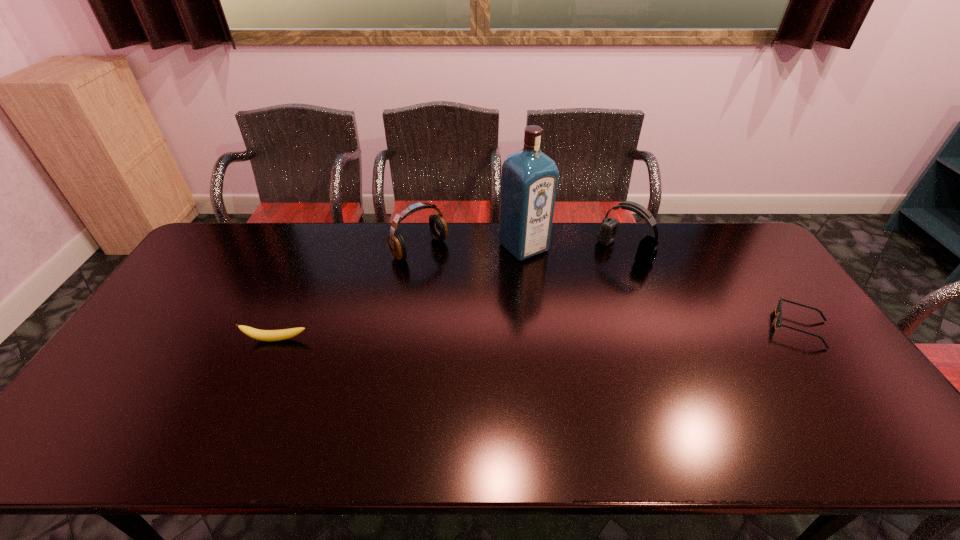
Image resolution: width=960 pixels, height=540 pixels. I want to click on free point between the rightmost object and the right headset, so click(x=712, y=289).

The height and width of the screenshot is (540, 960). Identify the location of free spot between the shortest object and the right headset. (712, 289).

Locate an element on the screen. free space that is in between the banana and the fourth object from right to left is located at coordinates (348, 294).

Image resolution: width=960 pixels, height=540 pixels. Identify the location of free space between the leftmost object and the rightmost object. (538, 333).

Image resolution: width=960 pixels, height=540 pixels. I want to click on free space between the second object from right to left and the banana, so click(x=450, y=295).

Locate an element on the screen. Image resolution: width=960 pixels, height=540 pixels. vacant area that lies between the fourth tallest object and the left headset is located at coordinates (348, 294).

This screenshot has height=540, width=960. What are the coordinates of `free space between the tallest object and the fourth object from right to left` in the screenshot? It's located at (471, 248).

Image resolution: width=960 pixels, height=540 pixels. I want to click on the fourth closest object to the liquor, so click(x=263, y=335).

Choose which object is the third nearest neighbor to the right headset. Please provide its 2D coordinates. Your answer should be formatted as a tuple, i.e. [(x, y)], where the tuple contains the x and y coordinates of a point satisfying the conditions above.

[(438, 228)]

The image size is (960, 540). In order to click on free spot that satisfies the following two spatial constraints: 1. on the back side of the tallest object; 2. on the left side of the second object from left to right in this screenshot , I will do `click(420, 247)`.